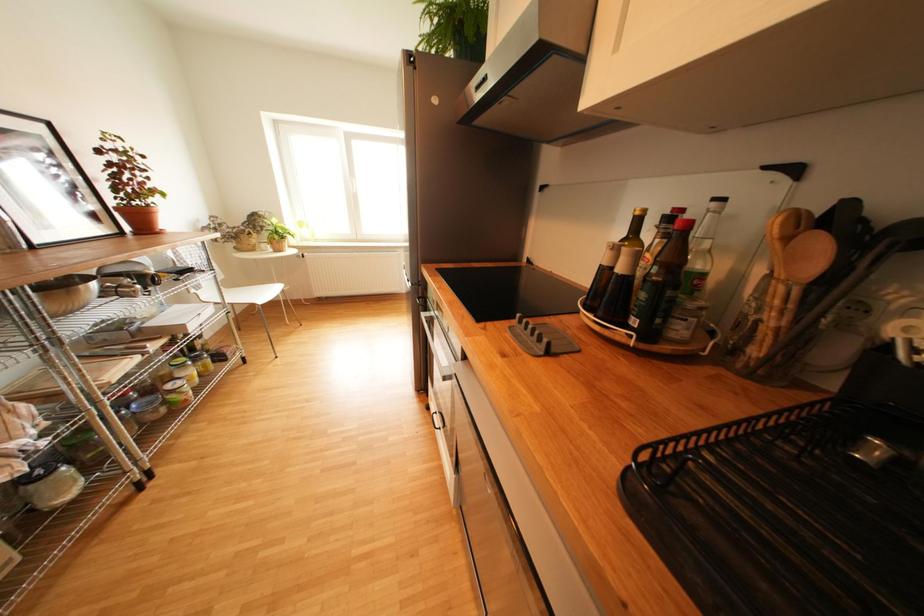
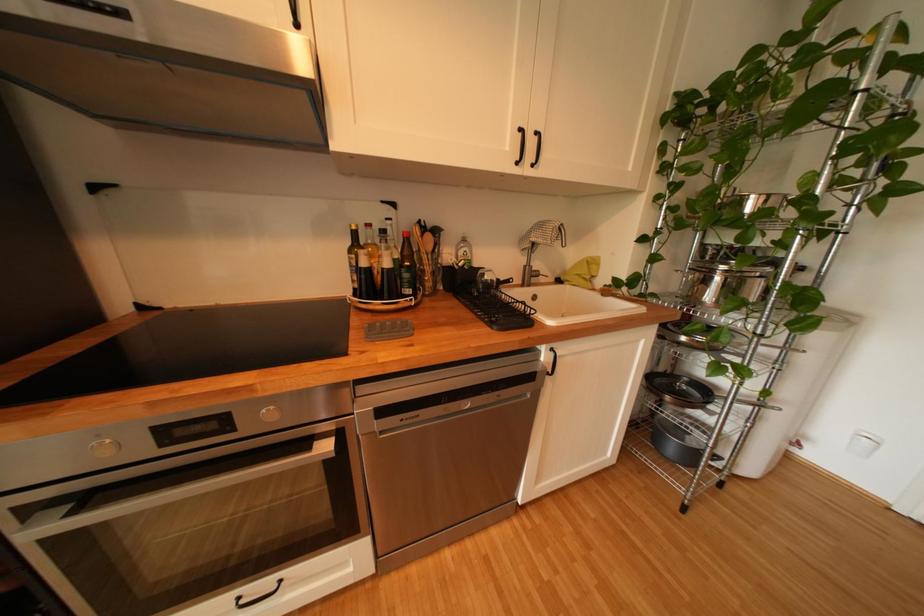
First-person continuous shooting, in which direction is the camera rotating?

The rotation direction of the camera is right-down.